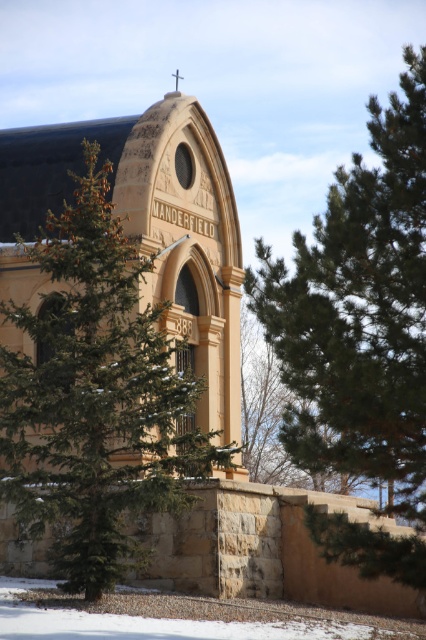
Question: Is green textured pine tree at center behind green leafy tree at center?

Choices:
 (A) no
 (B) yes

Answer: (B)

Question: Which point is farther to the camera?

Choices:
 (A) green textured pine tree at center
 (B) green leafy tree at center

Answer: (A)

Question: Is green textured pine tree at center bigger than green leafy tree at center?

Choices:
 (A) no
 (B) yes

Answer: (B)

Question: Which point is closer to the camera?

Choices:
 (A) green leafy tree at center
 (B) green textured pine tree at center

Answer: (A)

Question: Can you confirm if green textured pine tree at center is positioned above green leafy tree at center?

Choices:
 (A) yes
 (B) no

Answer: (B)

Question: Which of the following is the farthest from the observer?

Choices:
 (A) green textured pine tree at center
 (B) green leafy tree at center

Answer: (A)